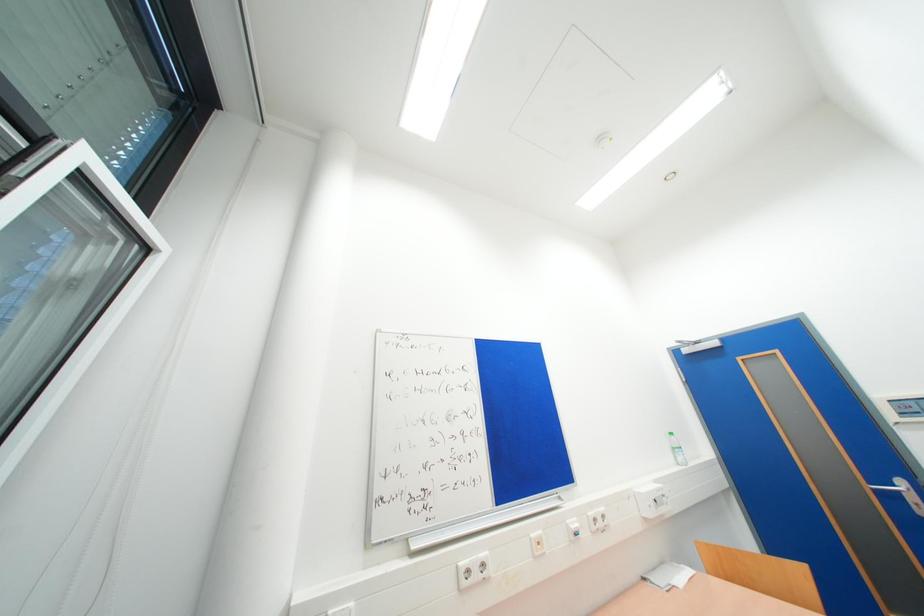
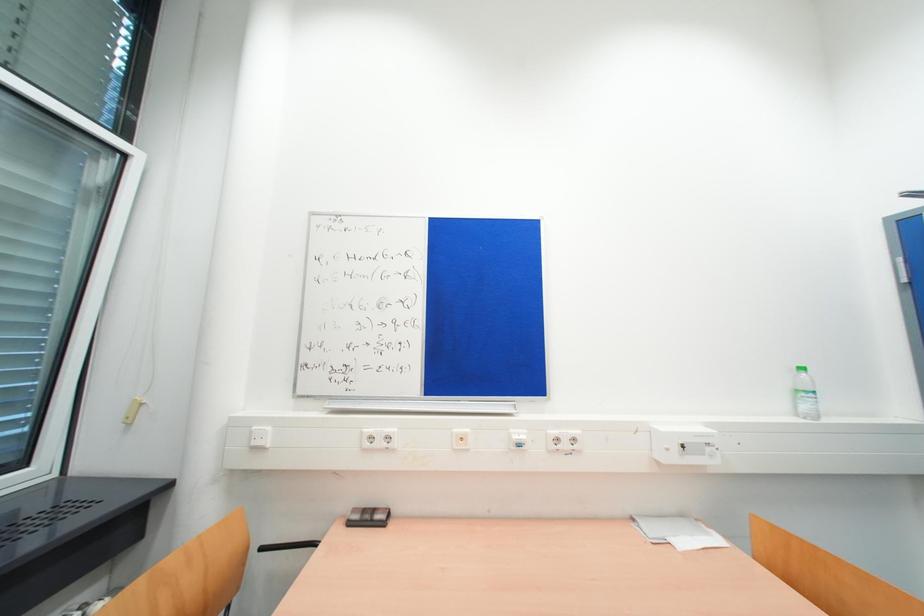
The images are taken continuously from a first-person perspective. In which direction is your viewpoint rotating?

The camera's rotation is toward left-down.